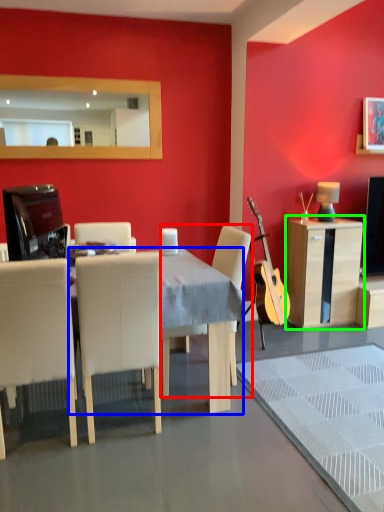
Question: Based on their relative distances, which object is farther from chair (highlighted by a red box)? Choose from desk (highlighted by a blue box) and cabinetry (highlighted by a green box).

Choices:
 (A) desk
 (B) cabinetry

Answer: (B)